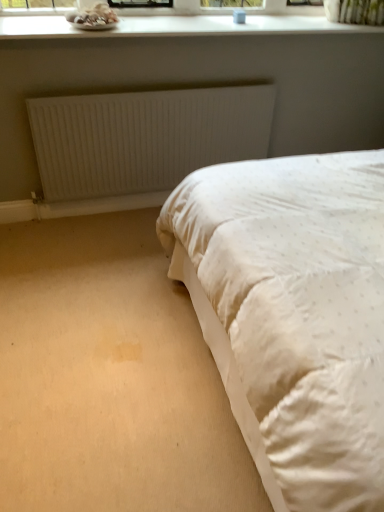
Question: Can you confirm if white matte radiator at upper center is bigger than white smooth window sill at upper center?

Choices:
 (A) yes
 (B) no

Answer: (B)

Question: Can you confirm if white matte radiator at upper center is positioned to the right of white smooth window sill at upper center?

Choices:
 (A) no
 (B) yes

Answer: (A)

Question: Is white matte radiator at upper center positioned with its back to white smooth window sill at upper center?

Choices:
 (A) yes
 (B) no

Answer: (B)

Question: From the image's perspective, is white matte radiator at upper center beneath white smooth window sill at upper center?

Choices:
 (A) yes
 (B) no

Answer: (A)

Question: Can you confirm if white matte radiator at upper center is wider than white smooth window sill at upper center?

Choices:
 (A) yes
 (B) no

Answer: (B)

Question: From a real-world perspective, does white matte radiator at upper center sit lower than white smooth window sill at upper center?

Choices:
 (A) yes
 (B) no

Answer: (A)

Question: Could you tell me if white smooth window sill at upper center is turned towards white matte radiator at upper center?

Choices:
 (A) yes
 (B) no

Answer: (B)

Question: Can you confirm if white smooth window sill at upper center is positioned to the right of white matte radiator at upper center?

Choices:
 (A) no
 (B) yes

Answer: (B)

Question: Can you confirm if white smooth window sill at upper center is smaller than white matte radiator at upper center?

Choices:
 (A) yes
 (B) no

Answer: (B)

Question: Is there a large distance between white smooth window sill at upper center and white matte radiator at upper center?

Choices:
 (A) no
 (B) yes

Answer: (A)

Question: Does white smooth window sill at upper center have a greater width compared to white matte radiator at upper center?

Choices:
 (A) yes
 (B) no

Answer: (A)

Question: Could white matte radiator at upper center be considered to be inside white smooth window sill at upper center?

Choices:
 (A) no
 (B) yes

Answer: (A)

Question: Choose the correct answer: Is white matte radiator at upper center inside white smooth window sill at upper center or outside it?

Choices:
 (A) inside
 (B) outside

Answer: (B)